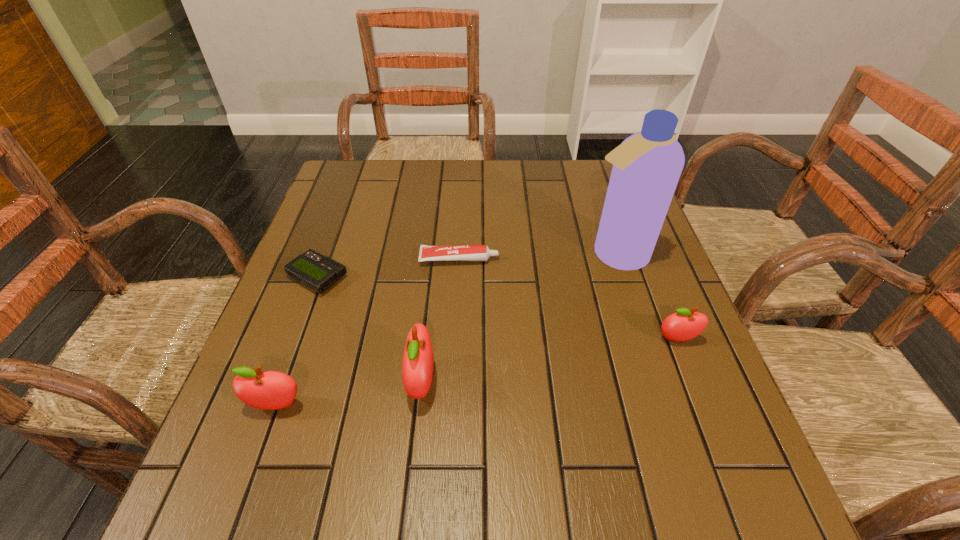
Identify the location of location for an additional apple to make spacing equal. (555, 360).